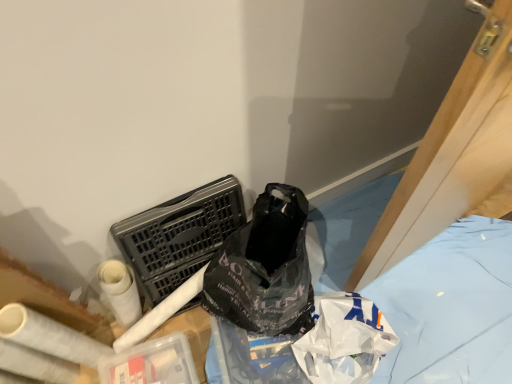
Question: From the image's perspective, would you say black plastic laundry basket at center-left is shown under black plastic bag at lower right?

Choices:
 (A) no
 (B) yes

Answer: (A)

Question: From the image's perspective, is black plastic laundry basket at center-left on black plastic bag at lower right?

Choices:
 (A) no
 (B) yes

Answer: (B)

Question: From a real-world perspective, is black plastic laundry basket at center-left over black plastic bag at lower right?

Choices:
 (A) yes
 (B) no

Answer: (A)

Question: Considering the relative sizes of black plastic laundry basket at center-left and black plastic bag at lower right in the image provided, is black plastic laundry basket at center-left wider than black plastic bag at lower right?

Choices:
 (A) no
 (B) yes

Answer: (A)

Question: Can we say black plastic laundry basket at center-left lies outside black plastic bag at lower right?

Choices:
 (A) no
 (B) yes

Answer: (B)

Question: Is black plastic bag at lower right inside the boundaries of black plastic laundry basket at center-left, or outside?

Choices:
 (A) inside
 (B) outside

Answer: (B)

Question: Is point (485, 274) positioned closer to the camera than point (173, 244)?

Choices:
 (A) closer
 (B) farther

Answer: (B)

Question: Considering the positions of black plastic bag at lower right and black plastic laundry basket at center-left in the image, is black plastic bag at lower right taller or shorter than black plastic laundry basket at center-left?

Choices:
 (A) short
 (B) tall

Answer: (A)

Question: In terms of width, does black plastic bag at lower right look wider or thinner when compared to black plastic laundry basket at center-left?

Choices:
 (A) thin
 (B) wide

Answer: (B)

Question: From the image's perspective, relative to black plastic bag at lower right, is black plastic laundry basket at center-left above or below?

Choices:
 (A) above
 (B) below

Answer: (A)

Question: In terms of width, does black plastic laundry basket at center-left look wider or thinner when compared to black plastic bag at lower right?

Choices:
 (A) wide
 (B) thin

Answer: (B)

Question: In terms of height, does black plastic laundry basket at center-left look taller or shorter compared to black plastic bag at lower right?

Choices:
 (A) tall
 (B) short

Answer: (A)

Question: Relative to black plastic bag at lower right, is black plastic laundry basket at center-left in front or behind?

Choices:
 (A) front
 (B) behind

Answer: (A)

Question: Is white matte toilet paper at lower left taller or shorter than black plastic bag at lower right?

Choices:
 (A) tall
 (B) short

Answer: (A)

Question: Is white matte toilet paper at lower left inside the boundaries of black plastic bag at lower right, or outside?

Choices:
 (A) inside
 (B) outside

Answer: (B)